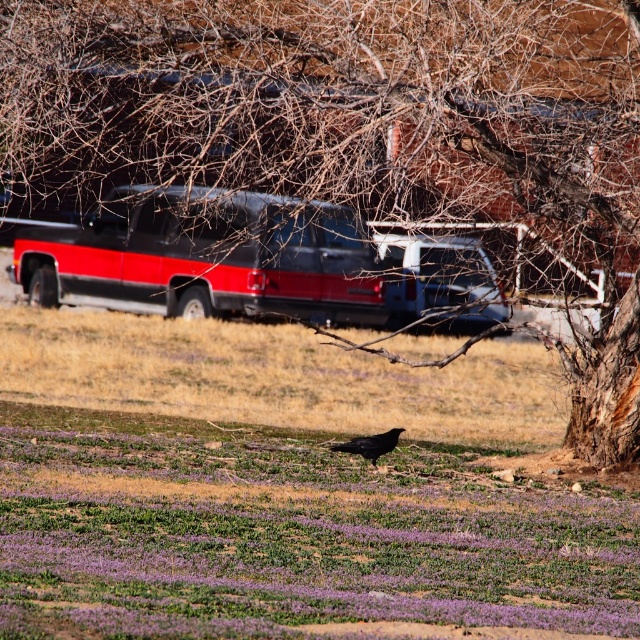
Can you confirm if black matte bird at center is positioned below shiny black bird at center?

Incorrect, black matte bird at center is not positioned below shiny black bird at center.

How distant is black matte bird at center from shiny black bird at center?

black matte bird at center and shiny black bird at center are 5.57 meters apart from each other.

Does point (472, 436) lie in front of point (372, 456)?

That is False.

Where is `black matte bird at center`? This screenshot has width=640, height=640. black matte bird at center is located at coordinates tap(284, 486).

Describe the element at coordinates (358, 125) in the screenshot. I see `bare wood tree at center` at that location.

Between bare wood tree at center and shiny black bird at center, which one has more height?

bare wood tree at center is taller.

What do you see at coordinates (358, 125) in the screenshot? This screenshot has width=640, height=640. I see `bare wood tree at center` at bounding box center [358, 125].

Identify the location of bare wood tree at center. Image resolution: width=640 pixels, height=640 pixels. (358, 125).

Does matte black tour bus at upper left appear on the right side of shiny black bird at center?

In fact, matte black tour bus at upper left is to the left of shiny black bird at center.

The width and height of the screenshot is (640, 640). What are the coordinates of `matte black tour bus at upper left` in the screenshot? It's located at (204, 257).

Is point (333, 305) positioned behind point (397, 435)?

That is True.

Identify the location of matte black tour bus at upper left. The width and height of the screenshot is (640, 640). (204, 257).